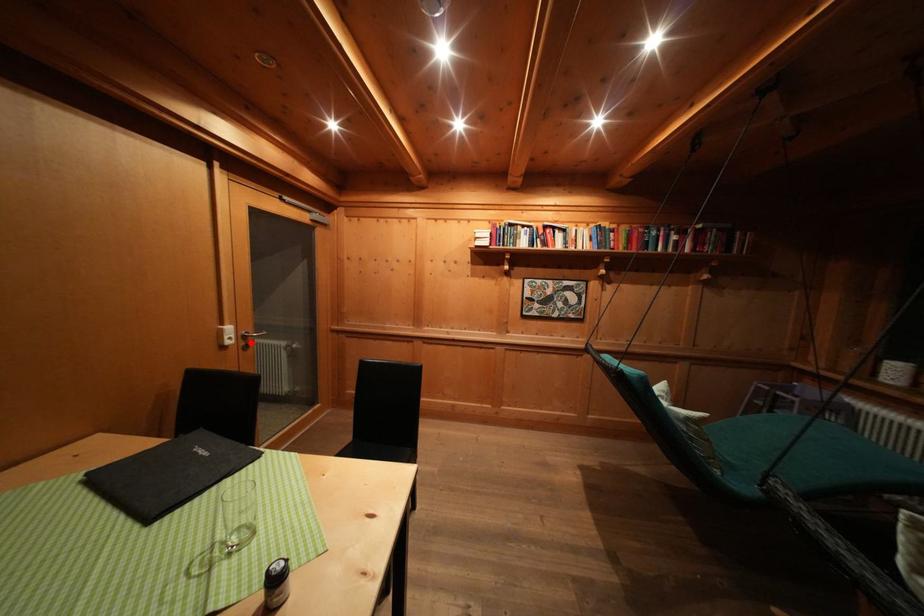
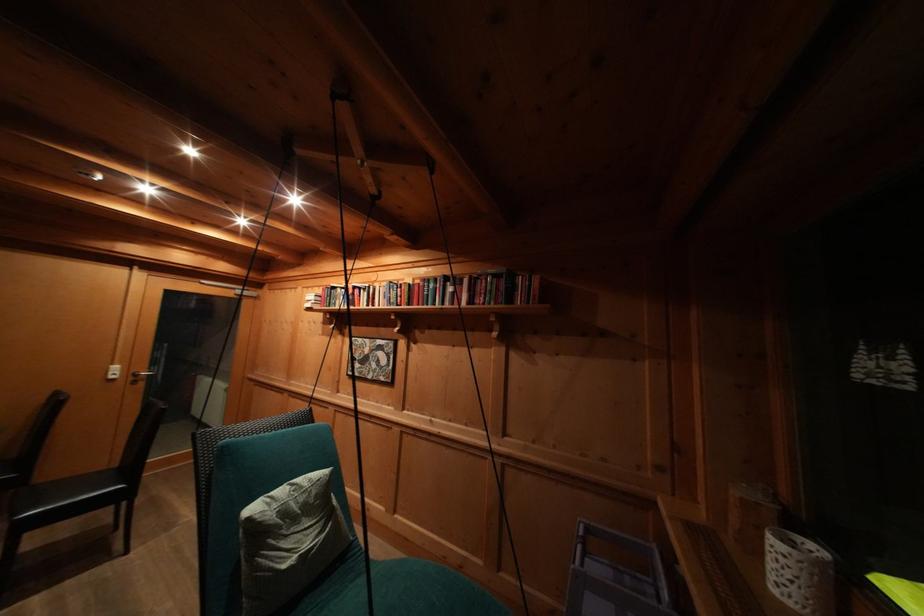
Question: I am providing you with two images of the same scene from different viewpoints. A red point is shown in image1. For the corresponding object point in image2, is it positioned nearer or farther from the camera?

Choices:
 (A) Nearer
 (B) Farther

Answer: (B)